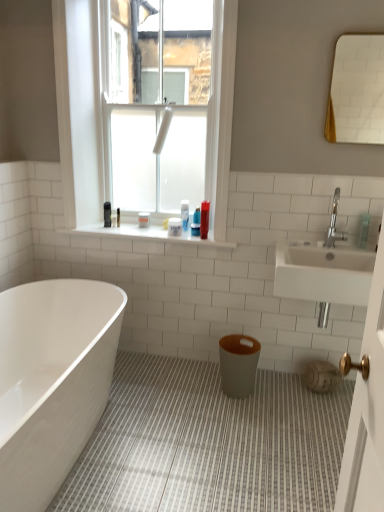
Question: From a real-world perspective, is matte gray vase at lower right located beneath translucent plastic bottle at upper center, the second toiletry viewed from the back?

Choices:
 (A) no
 (B) yes

Answer: (B)

Question: From a real-world perspective, is matte gray vase at lower right physically above translucent plastic bottle at upper center, the second toiletry viewed from the back?

Choices:
 (A) no
 (B) yes

Answer: (A)

Question: Does matte gray vase at lower right turn towards translucent plastic bottle at upper center, acting as the third toiletry starting from the left?

Choices:
 (A) no
 (B) yes

Answer: (A)

Question: Can you confirm if matte gray vase at lower right is positioned to the left of translucent plastic bottle at upper center, which appears as the 3th toiletry when viewed from the right?

Choices:
 (A) no
 (B) yes

Answer: (A)

Question: Is matte gray vase at lower right next to translucent plastic bottle at upper center, acting as the third toiletry starting from the left?

Choices:
 (A) yes
 (B) no

Answer: (B)

Question: Is translucent plastic bottle at upper center, acting as the third toiletry starting from the left, at the back of matte gray vase at lower right?

Choices:
 (A) no
 (B) yes

Answer: (A)

Question: From the image's perspective, is matte gray vase at lower right over white tile at upper center?

Choices:
 (A) yes
 (B) no

Answer: (B)

Question: From the image's perspective, is matte gray vase at lower right beneath white tile at upper center?

Choices:
 (A) no
 (B) yes

Answer: (B)

Question: Is matte gray vase at lower right shorter than white tile at upper center?

Choices:
 (A) yes
 (B) no

Answer: (B)

Question: Does matte gray vase at lower right have a lesser width compared to white tile at upper center?

Choices:
 (A) yes
 (B) no

Answer: (A)

Question: Is the depth of matte gray vase at lower right greater than that of white tile at upper center?

Choices:
 (A) no
 (B) yes

Answer: (A)

Question: Considering the relative sizes of matte gray vase at lower right and white tile at upper center in the image provided, is matte gray vase at lower right smaller than white tile at upper center?

Choices:
 (A) yes
 (B) no

Answer: (A)

Question: Is white glossy mirror at upper right positioned before translucent plastic bottle at upper center, placed as the fourth toiletry when sorted from front to back?

Choices:
 (A) no
 (B) yes

Answer: (B)